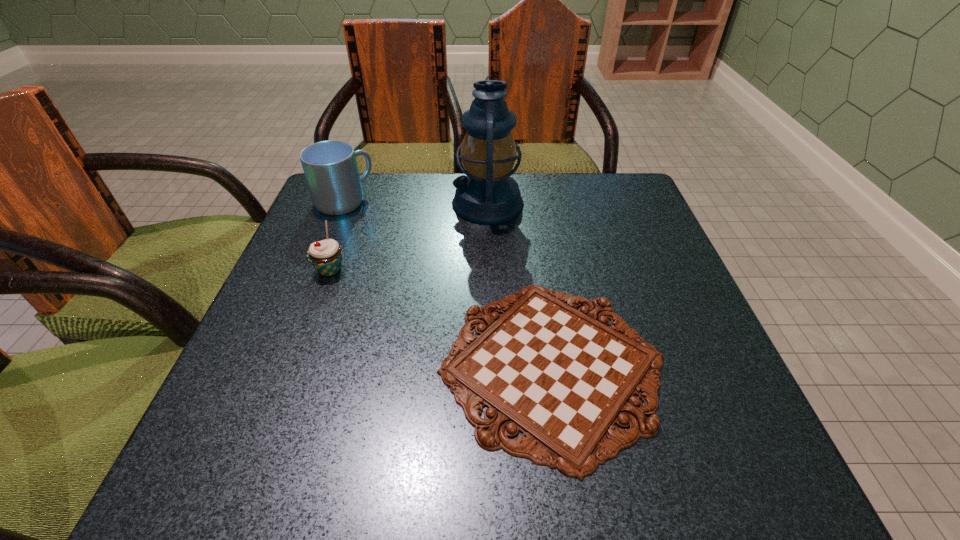
Locate an element on the screen. free space at the far edge of the desktop is located at coordinates (551, 182).

Where is `vacant space at the near edge of the desktop`? This screenshot has height=540, width=960. vacant space at the near edge of the desktop is located at coordinates (484, 487).

Locate an element on the screen. free space at the right edge is located at coordinates (659, 320).

Where is `vacant area at the far left corner of the desktop`? vacant area at the far left corner of the desktop is located at coordinates (331, 222).

Locate an element on the screen. This screenshot has height=540, width=960. free space at the near left corner of the desktop is located at coordinates (241, 476).

This screenshot has height=540, width=960. Find the location of `free space at the far right corner of the desktop`. free space at the far right corner of the desktop is located at coordinates (617, 200).

Locate an element on the screen. Image resolution: width=960 pixels, height=540 pixels. free space between the tallest object and the second shortest object is located at coordinates (409, 237).

The width and height of the screenshot is (960, 540). What are the coordinates of `free space between the third tallest object and the shortest object` in the screenshot? It's located at (441, 318).

Locate an element on the screen. free space that is in between the second shortest object and the second tallest object is located at coordinates (337, 235).

What are the coordinates of `empty space that is in between the mug and the cupcake` in the screenshot? It's located at [337, 235].